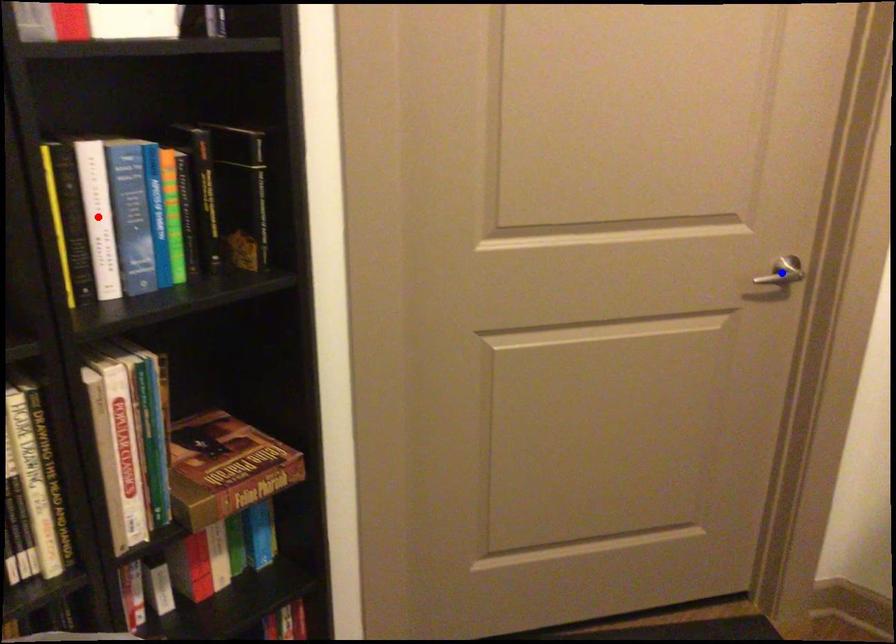
Question: In the image, two points are highlighted. Which point is nearer to the camera? Reply with the corresponding letter.

Choices:
 (A) blue point
 (B) red point

Answer: (B)